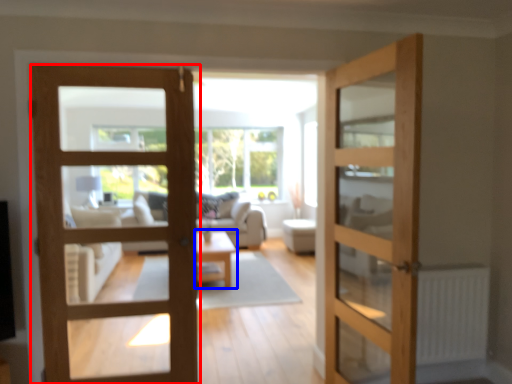
Question: Which of the following is the closest to the observer, door (highlighted by a red box) or table (highlighted by a blue box)?

Choices:
 (A) door
 (B) table

Answer: (A)